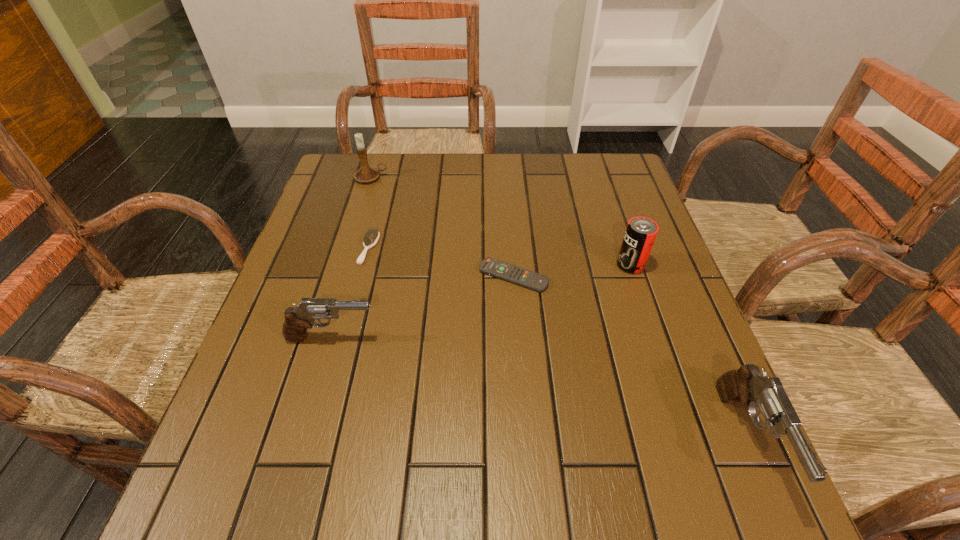
In order to click on free space located 0.290m on the side of the farthest object with the handle in this screenshot , I will do `click(486, 178)`.

Identify the location of vacant space situated on the back of the fifth object from left to right. (599, 173).

The height and width of the screenshot is (540, 960). In order to click on free space located on the right of the remote control in this screenshot , I will do `click(651, 276)`.

Locate an element on the screen. The height and width of the screenshot is (540, 960). vacant space located on the back of the scrubbing brush is located at coordinates (377, 219).

Image resolution: width=960 pixels, height=540 pixels. In order to click on object that is at the far edge in this screenshot , I will do `click(366, 174)`.

The image size is (960, 540). I want to click on object that is at the near edge, so pyautogui.click(x=746, y=385).

At what (x,y) coordinates should I click in order to perform the action: click on pistol that is at the left edge. Please return your answer as a coordinate pair (x, y). The width and height of the screenshot is (960, 540). Looking at the image, I should click on (297, 319).

This screenshot has width=960, height=540. Identify the location of candle holder positioned at the left edge. click(366, 174).

Where is `scrubbing brush present at the left edge`? The width and height of the screenshot is (960, 540). scrubbing brush present at the left edge is located at coordinates (372, 235).

You are a GUI agent. You are given a task and a screenshot of the screen. Output one action in this format:
    pyautogui.click(x=<x>, y=<y>)
    Task: Click on the pistol located at the right edge
    Image resolution: width=960 pixels, height=540 pixels.
    Given the screenshot: What is the action you would take?
    pyautogui.click(x=746, y=385)